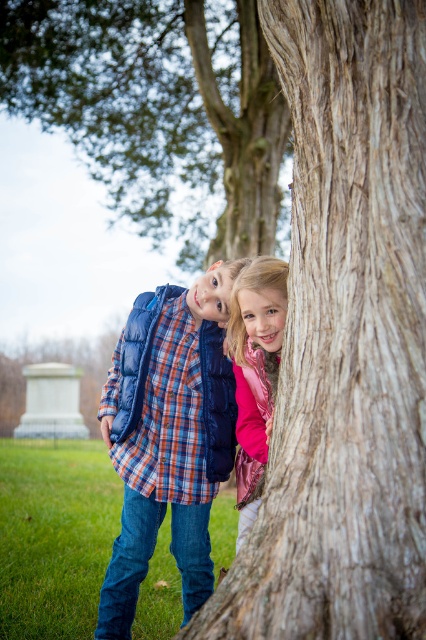
Question: Which object is the farthest from the pink metallic jacket at center?

Choices:
 (A) blue down jacket at center
 (B) smooth brown bark at center

Answer: (B)

Question: Does smooth brown bark at center lie in front of rough bark tree at upper center?

Choices:
 (A) no
 (B) yes

Answer: (B)

Question: Can you confirm if blue down jacket at center is thinner than pink metallic jacket at center?

Choices:
 (A) no
 (B) yes

Answer: (A)

Question: Which point is farther from the camera taking this photo?

Choices:
 (A) (158, 70)
 (B) (359, 566)
 (C) (244, 426)
 (D) (114, 390)

Answer: (A)

Question: Does rough bark tree at upper center have a greater width compared to blue down jacket at center?

Choices:
 (A) no
 (B) yes

Answer: (B)

Question: Which point appears closest to the camera in this image?

Choices:
 (A) (279, 321)
 (B) (270, 28)
 (C) (149, 348)
 (D) (166, 60)

Answer: (B)